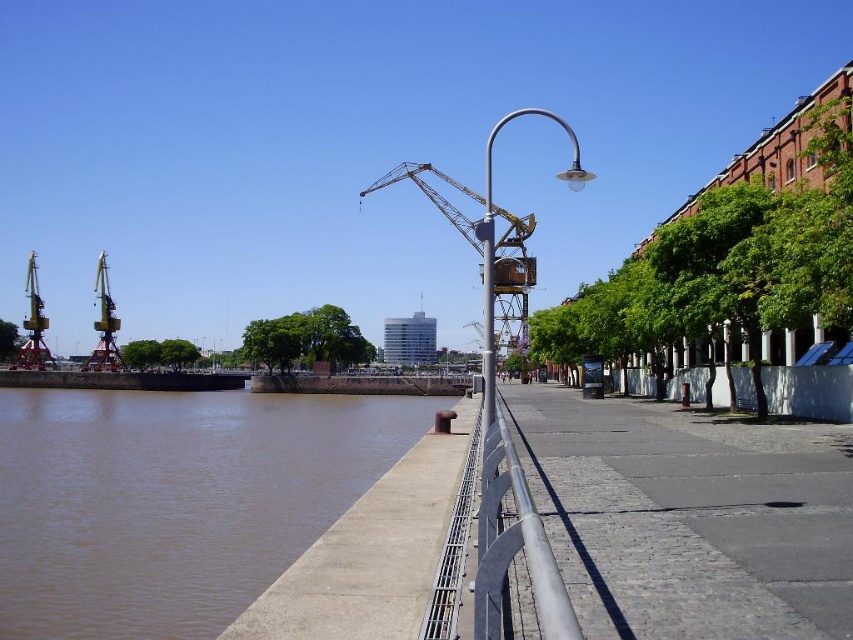
Question: Estimate the real-world distances between objects in this image. Which object is closer to the silver metallic rail at center?

Choices:
 (A) matte silver street light at upper center
 (B) cobblestone pavement at center

Answer: (B)

Question: Is yellow metallic crane at center to the right of silver metallic pole at center from the viewer's perspective?

Choices:
 (A) no
 (B) yes

Answer: (B)

Question: Based on their relative distances, which object is nearer to the brown concrete river at lower left?

Choices:
 (A) silver metallic pole at center
 (B) matte silver street light at upper center

Answer: (A)

Question: Which point is closer to the camera taking this photo?

Choices:
 (A) (456, 529)
 (B) (337, 400)
 (C) (412, 173)
 (D) (488, 134)

Answer: (A)

Question: Can you confirm if cobblestone pavement at center is positioned to the right of yellow metallic crane at center?

Choices:
 (A) no
 (B) yes

Answer: (B)

Question: Does cobblestone pavement at center have a greater width compared to yellow metallic crane at center?

Choices:
 (A) yes
 (B) no

Answer: (B)